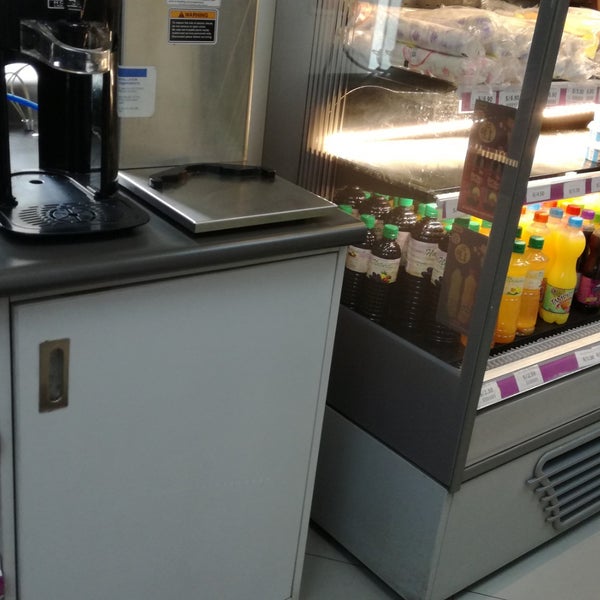
Locate an element on the screen. The width and height of the screenshot is (600, 600). front edge of grey countertop is located at coordinates (257, 254).